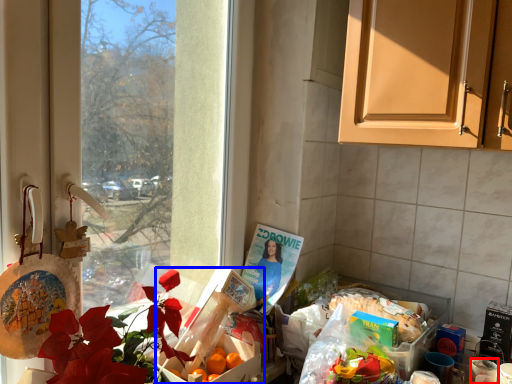
Question: Which object is further to the camera taking this photo, coffee cup (highlighted by a red box) or box (highlighted by a blue box)?

Choices:
 (A) coffee cup
 (B) box

Answer: (B)